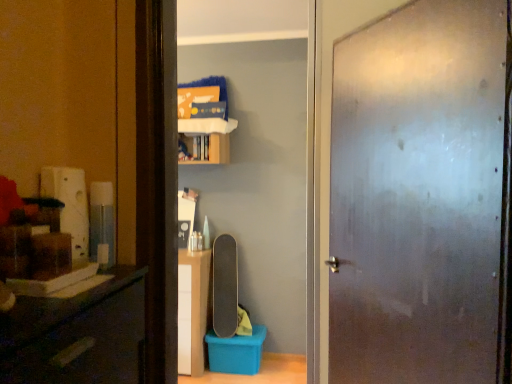
Locate an element on the screen. The image size is (512, 384). smooth black skateboard at center is located at coordinates (224, 286).

Identify the location of frosted glass door at center. Image resolution: width=512 pixels, height=384 pixels. (418, 195).

Is frosted glass door at center smaller than smooth black skateboard at center?

No, frosted glass door at center is not smaller than smooth black skateboard at center.

At what (x,y) coordinates should I click in order to perform the action: click on skateboard below the frosted glass door at center (from the image's perspective). Please return your answer as a coordinate pair (x, y). The height and width of the screenshot is (384, 512). Looking at the image, I should click on (224, 286).

Who is taller, frosted glass door at center or smooth black skateboard at center?

frosted glass door at center.

Is frosted glass door at center touching smooth black skateboard at center?

No, frosted glass door at center is not making contact with smooth black skateboard at center.

Are wooden cabinet at upper center and frosted glass door at center located far from each other?

Yes.

From a real-world perspective, is wooden cabinet at upper center over frosted glass door at center?

Indeed, from a real-world perspective, wooden cabinet at upper center stands above frosted glass door at center.

Looking at this image, is wooden cabinet at upper center further to camera compared to frosted glass door at center?

Yes, it is.

Which is farther, (438,113) or (213,140)?

Positioned behind is point (213,140).

Is frosted glass door at center oriented away from wooden cabinet at upper center?

No, frosted glass door at center's orientation is not away from wooden cabinet at upper center.

Choose the correct answer: Is frosted glass door at center inside wooden cabinet at upper center or outside it?

frosted glass door at center is not enclosed by wooden cabinet at upper center.

Which object is positioned more to the right, frosted glass door at center or wooden cabinet at upper center?

frosted glass door at center.

Which object is closer to the camera taking this photo, smooth black skateboard at center or frosted glass door at center?

frosted glass door at center is more forward.

Consider the image. From the image's perspective, is smooth black skateboard at center over frosted glass door at center?

No.

In the scene shown: Is smooth black skateboard at center surrounding frosted glass door at center?

No.

Is smooth black skateboard at center facing away from frosted glass door at center?

No, smooth black skateboard at center's orientation is not away from frosted glass door at center.

Are smooth black skateboard at center and wooden cabinet at upper center far apart?

Actually, smooth black skateboard at center and wooden cabinet at upper center are a little close together.

Considering the relative sizes of smooth black skateboard at center and wooden cabinet at upper center in the image provided, is smooth black skateboard at center shorter than wooden cabinet at upper center?

In fact, smooth black skateboard at center may be taller than wooden cabinet at upper center.

In the image, is smooth black skateboard at center on the left side or the right side of wooden cabinet at upper center?

Clearly, smooth black skateboard at center is on the right of wooden cabinet at upper center in the image.

Is smooth black skateboard at center positioned with its back to wooden cabinet at upper center?

That's not correct — smooth black skateboard at center is not looking away from wooden cabinet at upper center.

Who is taller, wooden cabinet at upper center or smooth black skateboard at center?

With more height is smooth black skateboard at center.

From the picture: How far apart are wooden cabinet at upper center and smooth black skateboard at center?

wooden cabinet at upper center is 88.67 centimeters away from smooth black skateboard at center.

Could you tell me if wooden cabinet at upper center is turned towards smooth black skateboard at center?

No, wooden cabinet at upper center is not oriented towards smooth black skateboard at center.

Which object is further away from the camera taking this photo, wooden cabinet at upper center or smooth black skateboard at center?

smooth black skateboard at center is more distant.

What are the coordinates of `skateboard below the frosted glass door at center (from a real-world perspective)` in the screenshot? It's located at (224, 286).

I want to click on door on the right side of wooden cabinet at upper center, so click(x=418, y=195).

Which object lies further to the anchor point smooth black skateboard at center, frosted glass door at center or wooden cabinet at upper center?

frosted glass door at center is further to smooth black skateboard at center.

Based on their spatial positions, is smooth black skateboard at center or frosted glass door at center closer to wooden cabinet at upper center?

smooth black skateboard at center is closer to wooden cabinet at upper center.

Based on their spatial positions, is wooden cabinet at upper center or frosted glass door at center further from smooth black skateboard at center?

Based on the image, frosted glass door at center appears to be further to smooth black skateboard at center.

From the image, which object appears to be farther from wooden cabinet at upper center, frosted glass door at center or smooth black skateboard at center?

The object further to wooden cabinet at upper center is frosted glass door at center.

From the picture: Based on their spatial positions, is wooden cabinet at upper center or smooth black skateboard at center closer to frosted glass door at center?

Among the two, wooden cabinet at upper center is located nearer to frosted glass door at center.

Consider the image. When comparing their distances from frosted glass door at center, does smooth black skateboard at center or wooden cabinet at upper center seem further?

The object further to frosted glass door at center is smooth black skateboard at center.

You are a GUI agent. You are given a task and a screenshot of the screen. Output one action in this format:
    pyautogui.click(x=<x>, y=<y>)
    Task: Click on the cabinet located between frosted glass door at center and smooth black skateboard at center in the depth direction
    
    Given the screenshot: What is the action you would take?
    pyautogui.click(x=215, y=150)